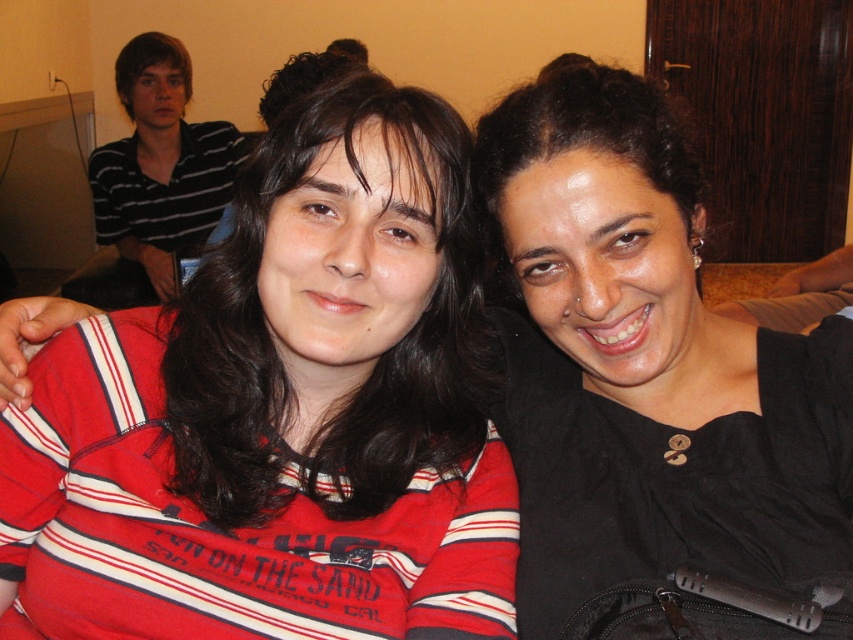
Is point (724, 470) positioned after point (103, 243)?

No, it is not.

What do you see at coordinates (653, 387) in the screenshot? The width and height of the screenshot is (853, 640). I see `black matte hair at upper right` at bounding box center [653, 387].

Is point (691, 426) farther from viewer compared to point (236, 148)?

No, it is in front of (236, 148).

Identify the location of black matte hair at upper right. (653, 387).

Who is shorter, red striped shirt at left or black matte hair at upper right?

With less height is red striped shirt at left.

From the picture: Between red striped shirt at left and black matte hair at upper right, which one has more height?

With more height is black matte hair at upper right.

What do you see at coordinates (280, 413) in the screenshot? I see `red striped shirt at left` at bounding box center [280, 413].

Locate an element on the screen. This screenshot has width=853, height=640. red striped shirt at left is located at coordinates (280, 413).

Is red striped shirt at left taller than striped cotton shirt at upper left?

In fact, red striped shirt at left may be shorter than striped cotton shirt at upper left.

Consider the image. Does red striped shirt at left appear over striped cotton shirt at upper left?

No, red striped shirt at left is not above striped cotton shirt at upper left.

Is point (45, 403) positioned behind point (107, 221)?

No, (45, 403) is closer to viewer.

You are a GUI agent. You are given a task and a screenshot of the screen. Output one action in this format:
    pyautogui.click(x=<x>, y=<y>)
    Task: Click on the red striped shirt at left
    The height and width of the screenshot is (640, 853).
    Given the screenshot: What is the action you would take?
    pyautogui.click(x=280, y=413)